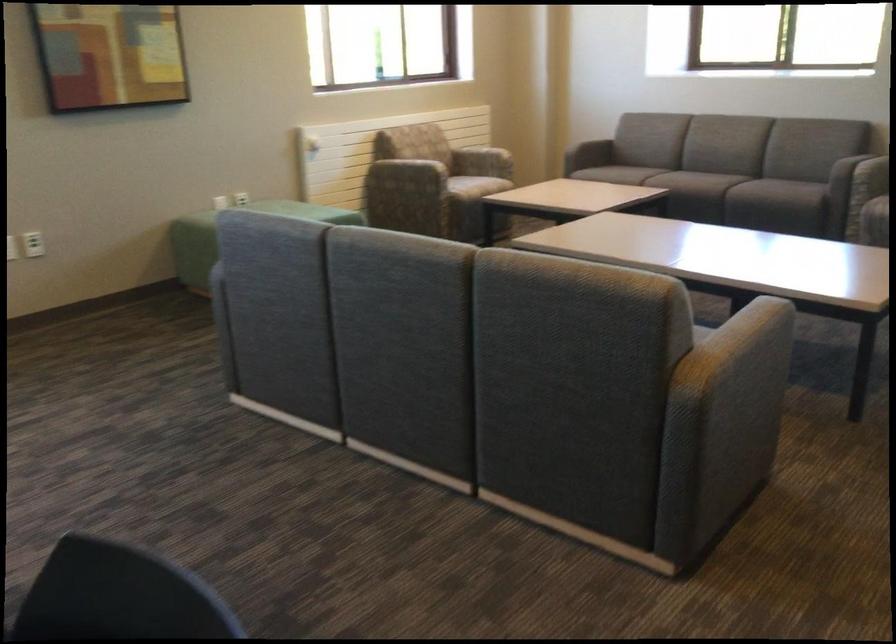
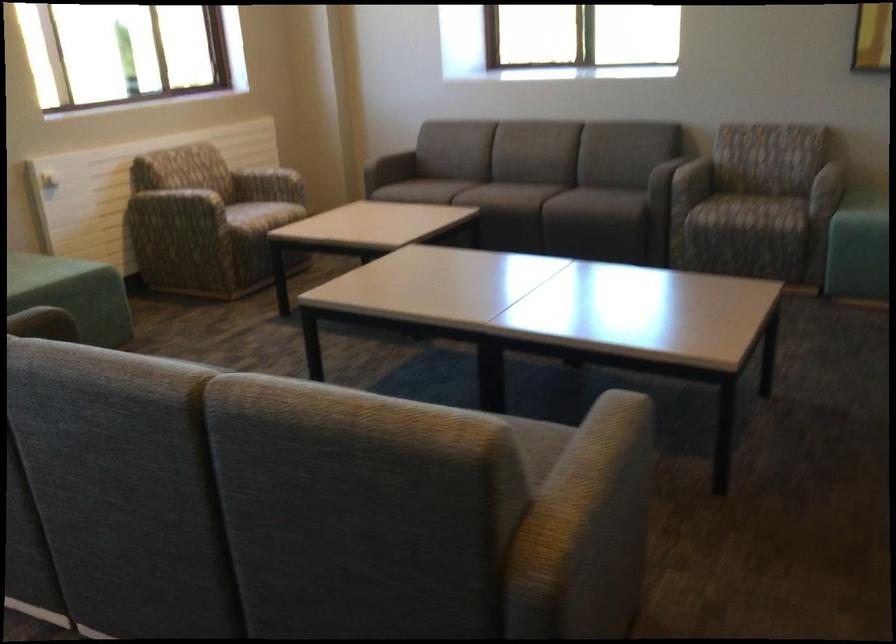
Question: The first image is from the beginning of the video and the second image is from the end. How did the camera likely rotate when shooting the video?

Choices:
 (A) Left
 (B) Right
 (C) Up
 (D) Down

Answer: (B)